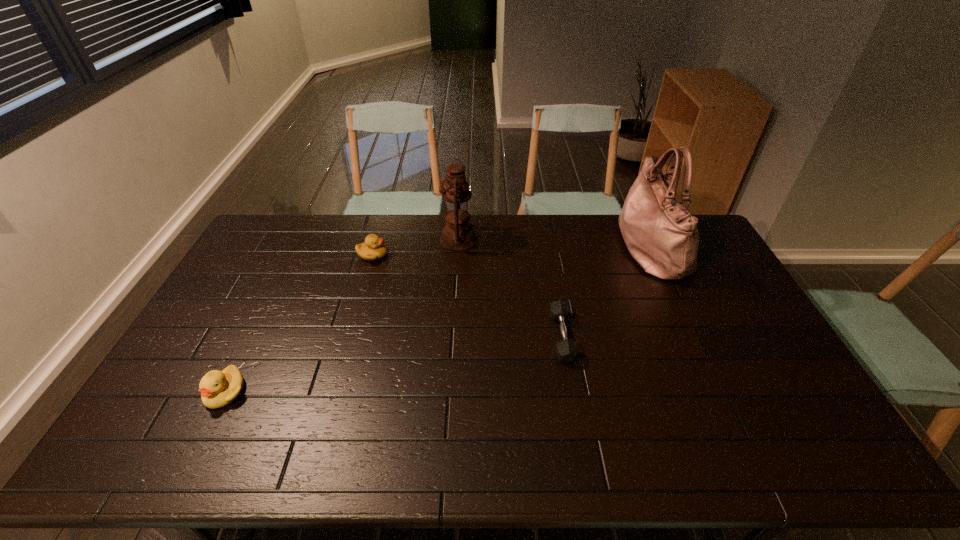
At what (x,y) coordinates should I click in order to perform the action: click on the tallest object. Please return your answer as a coordinate pair (x, y). The width and height of the screenshot is (960, 540). Looking at the image, I should click on (661, 234).

This screenshot has width=960, height=540. I want to click on the rightmost object, so click(661, 234).

You are a GUI agent. You are given a task and a screenshot of the screen. Output one action in this format:
    pyautogui.click(x=<x>, y=<y>)
    Task: Click on the oil lamp
    
    Given the screenshot: What is the action you would take?
    pyautogui.click(x=458, y=234)

This screenshot has width=960, height=540. In order to click on the fourth shortest object in this screenshot , I will do `click(458, 234)`.

Where is `the farther duckling`? the farther duckling is located at coordinates (373, 248).

Where is `the second object from left to right`? the second object from left to right is located at coordinates (373, 248).

Locate an element on the screen. The width and height of the screenshot is (960, 540). the left duckling is located at coordinates (218, 389).

You are a GUI agent. You are given a task and a screenshot of the screen. Output one action in this format:
    pyautogui.click(x=<x>, y=<y>)
    Task: Click on the nearest object
    
    Given the screenshot: What is the action you would take?
    pyautogui.click(x=218, y=389)

Where is `dumbbell`? This screenshot has width=960, height=540. dumbbell is located at coordinates (566, 350).

Where is `the shortest object`? the shortest object is located at coordinates (566, 350).